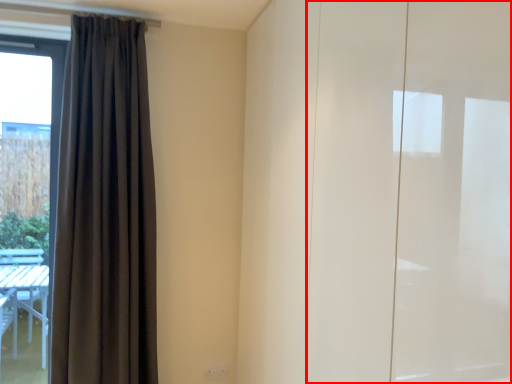
Question: From the image's perspective, where is screen door (annotated by the red box) located in relation to curtain in the image?

Choices:
 (A) below
 (B) above

Answer: (A)